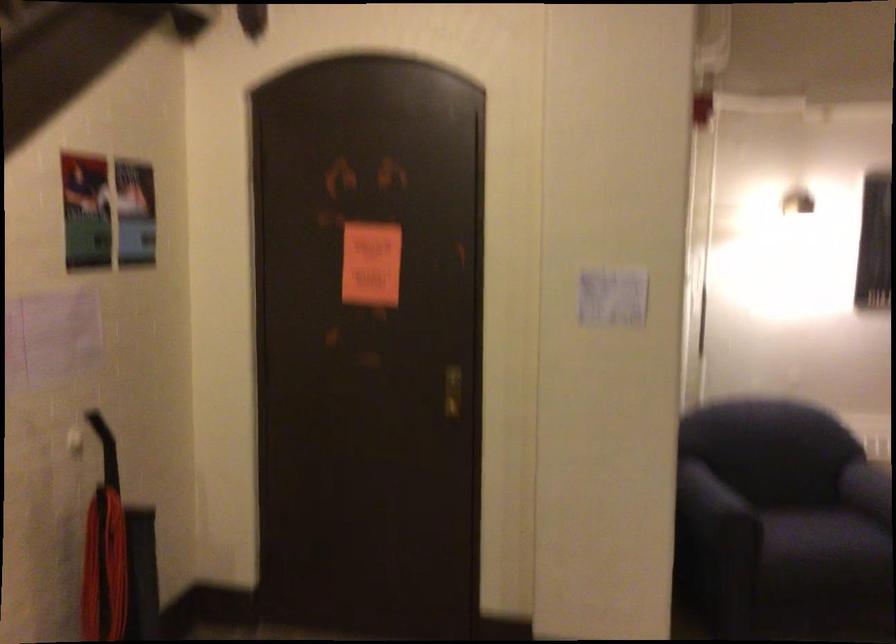
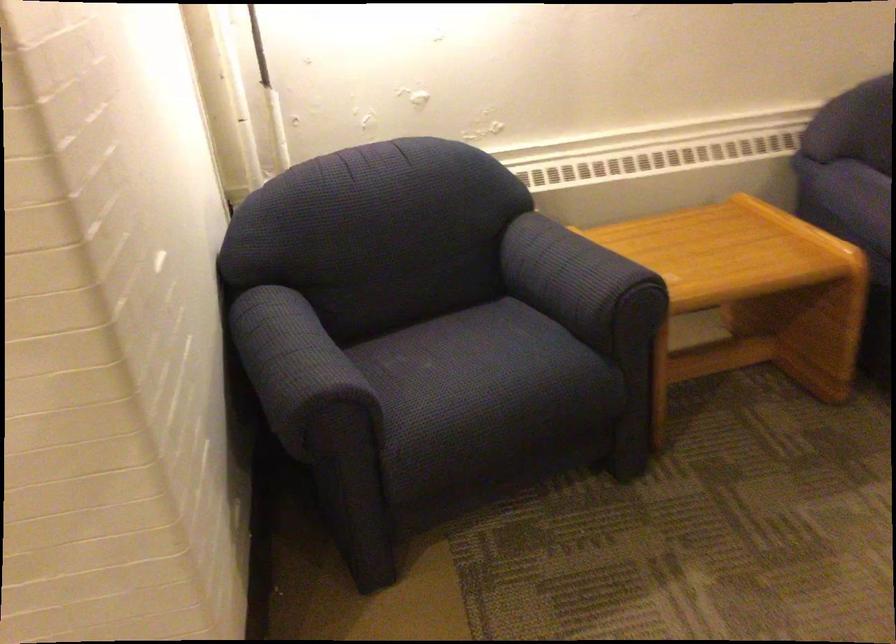
The point at (x=806, y=533) is marked in the first image. Where is the corresponding point in the second image?

(487, 377)